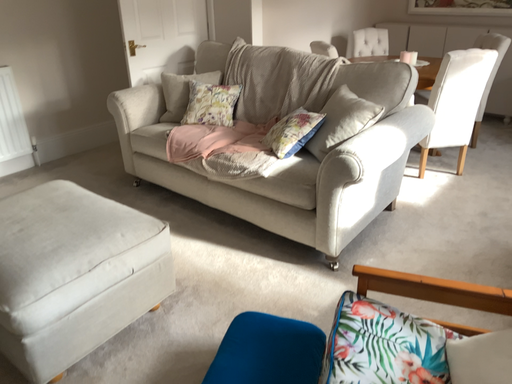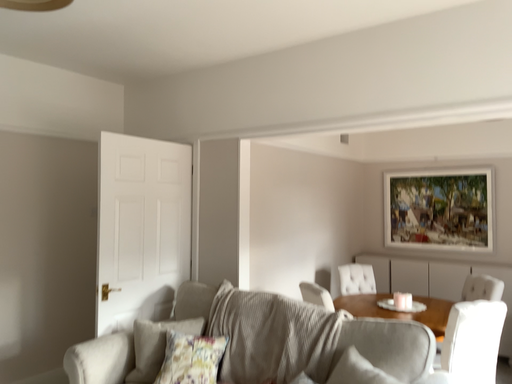
Question: Which way did the camera rotate in the video?

Choices:
 (A) rotated upward
 (B) rotated downward

Answer: (A)